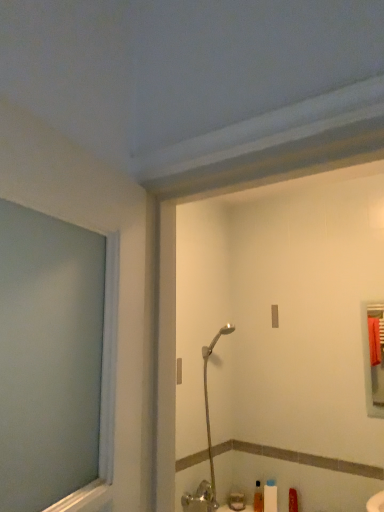
Question: Is translucent plastic soap dispenser at lower center to the left or to the right of silver metallic shower head at center in the image?

Choices:
 (A) right
 (B) left

Answer: (A)

Question: Is translucent plastic soap dispenser at lower center inside or outside of silver metallic shower head at center?

Choices:
 (A) inside
 (B) outside

Answer: (B)

Question: Which is farther from the silver metallic shower head at center?

Choices:
 (A) translucent plastic soap dispenser at lower center
 (B) white matte toilet paper at lower center

Answer: (B)

Question: Estimate the real-world distances between objects in this image. Which object is farther from the white matte toilet paper at lower center?

Choices:
 (A) translucent plastic soap dispenser at lower center
 (B) silver metallic shower head at center

Answer: (B)